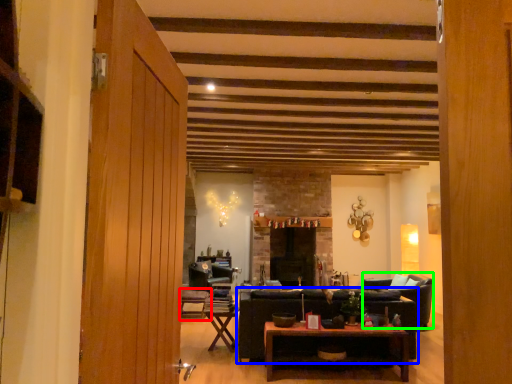
Question: Which object is positioned closest to chair (highlighted by a red box)? Select from studio couch (highlighted by a blue box) and armchair (highlighted by a green box).

Choices:
 (A) studio couch
 (B) armchair

Answer: (A)